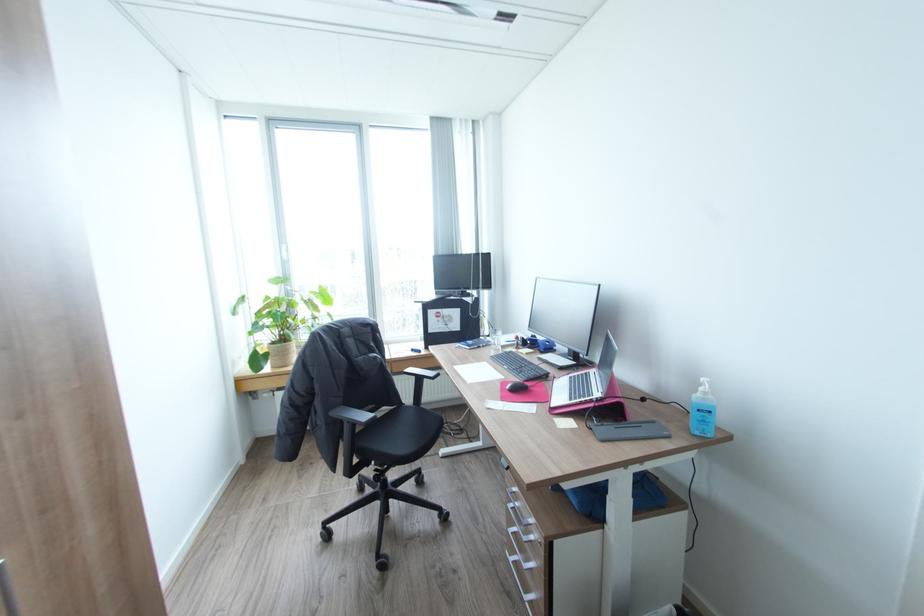
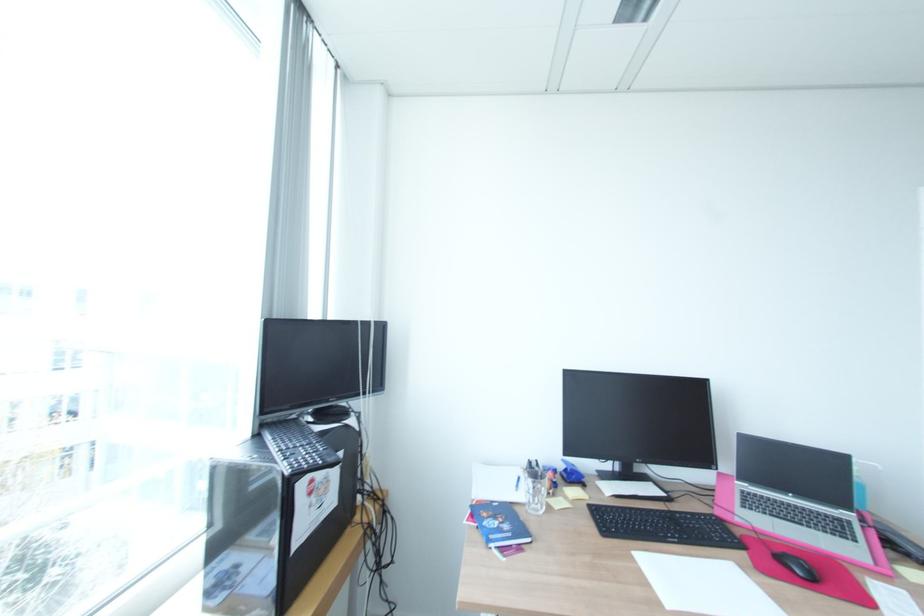
The point at [472,342] is marked in the first image. Where is the corresponding point in the second image?

(504, 530)